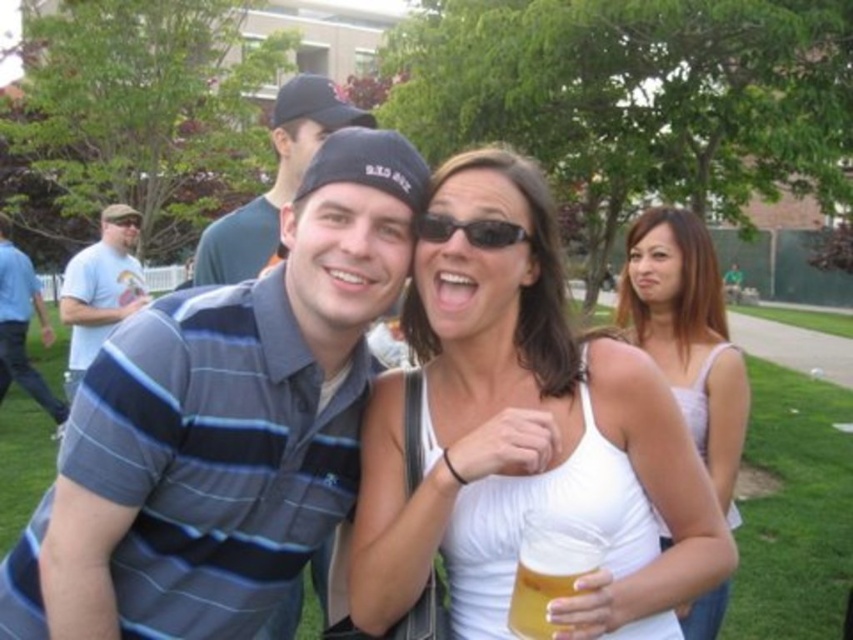
Question: Which point is farther from the camera taking this photo?

Choices:
 (A) 68,285
 (B) 573,566
 (C) 715,269

Answer: (A)

Question: Which point is closer to the camera taking this photo?

Choices:
 (A) (299, 148)
 (B) (10, 349)
 (C) (633, 305)

Answer: (A)

Question: Is white matte tank top at center to the right of white fabric tank top at upper right from the viewer's perspective?

Choices:
 (A) yes
 (B) no

Answer: (B)

Question: Does translucent glass mug at lower center have a greater width compared to blue striped polo shirt at left?

Choices:
 (A) yes
 (B) no

Answer: (B)

Question: Is translucent glass mug at lower center below blue striped polo shirt at left?

Choices:
 (A) no
 (B) yes

Answer: (B)

Question: Which point is farther to the camera?

Choices:
 (A) translucent glass mug at lower center
 (B) blue striped shirt at center

Answer: (B)